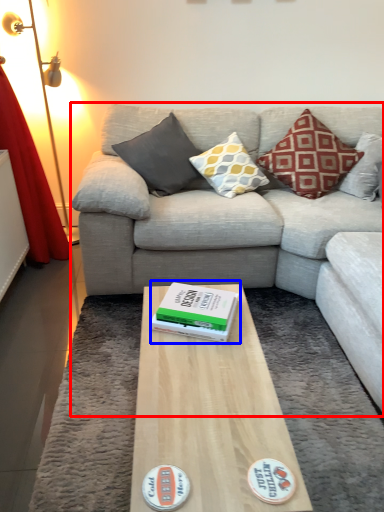
Question: Which point is further to the camera, studio couch (highlighted by a red box) or paperback book (highlighted by a blue box)?

Choices:
 (A) studio couch
 (B) paperback book

Answer: (B)